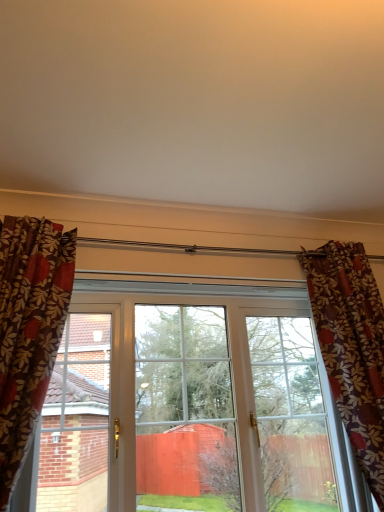
Question: From the image's perspective, is floral fabric curtain at right above or below white plastic window at center?

Choices:
 (A) above
 (B) below

Answer: (A)

Question: Is floral fabric curtain at right taller or shorter than white plastic window at center?

Choices:
 (A) tall
 (B) short

Answer: (A)

Question: Considering the positions of floral fabric curtain at right and white plastic window at center in the image, is floral fabric curtain at right bigger or smaller than white plastic window at center?

Choices:
 (A) small
 (B) big

Answer: (B)

Question: Which is correct: white plastic window at center is inside floral fabric curtain at right, or outside of it?

Choices:
 (A) inside
 (B) outside

Answer: (B)

Question: Does point (276, 501) appear closer or farther from the camera than point (306, 256)?

Choices:
 (A) farther
 (B) closer

Answer: (A)

Question: Based on their sizes in the image, would you say white plastic window at center is bigger or smaller than floral fabric curtain at right?

Choices:
 (A) big
 (B) small

Answer: (B)

Question: From the image's perspective, is white plastic window at center above or below floral fabric curtain at right?

Choices:
 (A) below
 (B) above

Answer: (A)